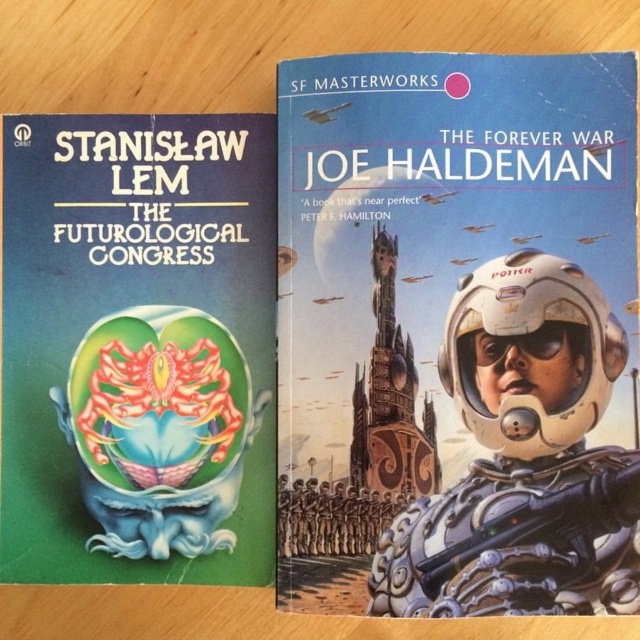
In the scene shown: You are an astronaut trying to choose between two spacesuits displayed on a shelf. One is the metallic silver spacesuit at center and the other is the white metallic astronaut at center. Based on their sizes, which spacesuit would you choose if you need a larger one for better mobility?

You should choose the metallic silver spacesuit at center because its width is larger than the white metallic astronaut at center, providing more space for movement.

You are an alien trying to decide which book to take to your spaceship. You need to know which object is wider between the green matte brain at center and the white metallic astronaut at center. Which one is wider?

The green matte brain at center is wider than the white metallic astronaut at center according to the description.